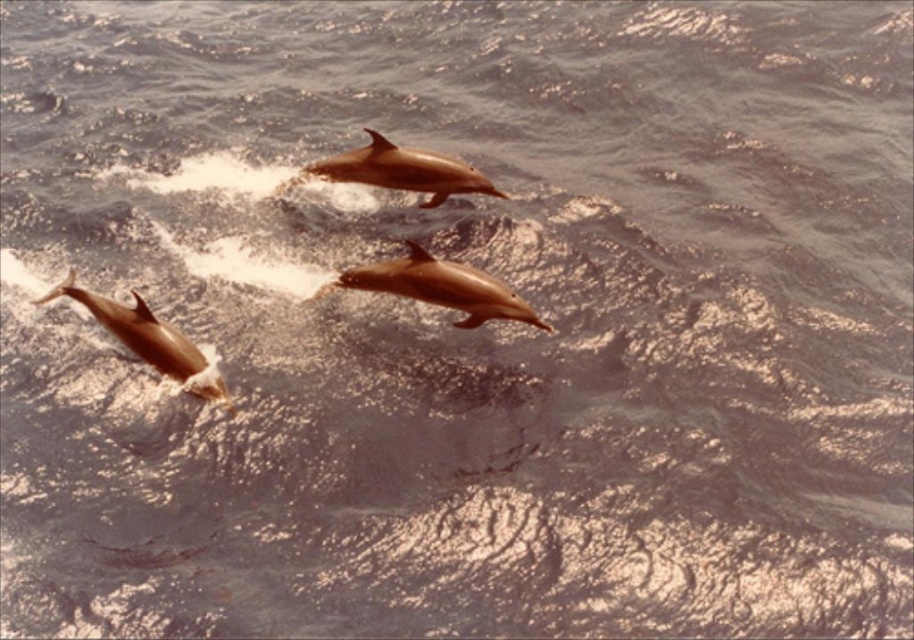
Is shiny brown dolphin at center thinner than light brown smooth dolphin at lower left?

Yes, shiny brown dolphin at center is thinner than light brown smooth dolphin at lower left.

How distant is shiny brown dolphin at center from light brown smooth dolphin at lower left?

shiny brown dolphin at center is 37.95 inches from light brown smooth dolphin at lower left.

Describe the element at coordinates (441, 288) in the screenshot. The image size is (914, 640). I see `shiny brown dolphin at center` at that location.

Where is `shiny brown dolphin at center`? This screenshot has height=640, width=914. shiny brown dolphin at center is located at coordinates (441, 288).

Who is lower down, smooth brown dolphin at center or light brown smooth dolphin at lower left?

light brown smooth dolphin at lower left

Who is shorter, smooth brown dolphin at center or light brown smooth dolphin at lower left?

smooth brown dolphin at center is shorter.

Does point (428, 180) come behind point (145, 328)?

Yes.

Find the location of a particular element. This screenshot has width=914, height=640. smooth brown dolphin at center is located at coordinates (402, 170).

Between shiny brown dolphin at center and smooth brown dolphin at center, which one has less height?

With less height is smooth brown dolphin at center.

Where is `shiny brown dolphin at center`? This screenshot has width=914, height=640. shiny brown dolphin at center is located at coordinates (441, 288).

The width and height of the screenshot is (914, 640). What do you see at coordinates (441, 288) in the screenshot?
I see `shiny brown dolphin at center` at bounding box center [441, 288].

The width and height of the screenshot is (914, 640). I want to click on shiny brown dolphin at center, so click(x=441, y=288).